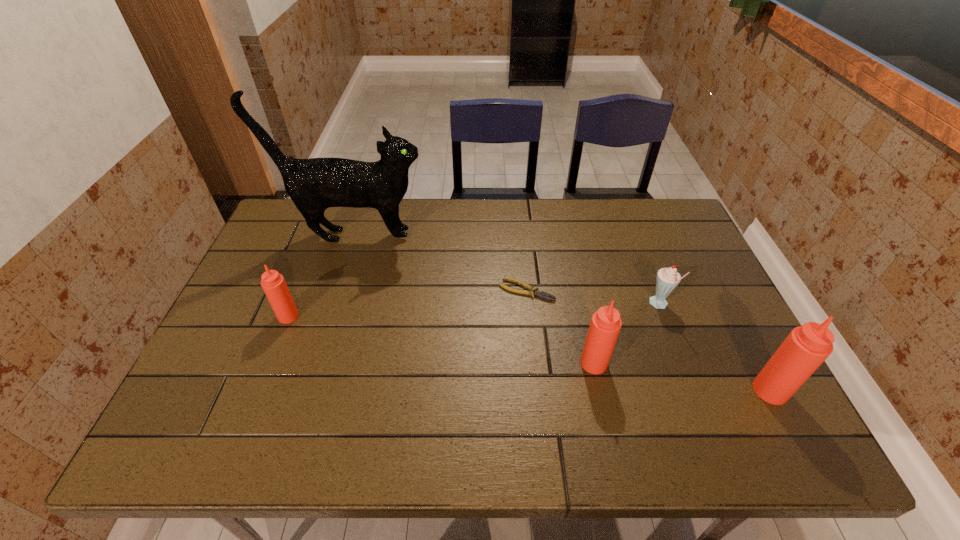
Find the location of `cat`. cat is located at coordinates (315, 184).

Where is `the farthest object`? Image resolution: width=960 pixels, height=540 pixels. the farthest object is located at coordinates (315, 184).

Find the location of a particular element. blank space located on the back of the farthest Tabasco sauce is located at coordinates (303, 280).

Find the location of a particular element. The image size is (960, 540). free region located on the back of the second nearest object is located at coordinates pyautogui.click(x=572, y=264).

The height and width of the screenshot is (540, 960). Identify the location of free location located on the left of the rightmost Tabasco sauce. (684, 390).

At what (x,y) coordinates should I click in order to perform the action: click on vacant space located on the straw side of the second object from right to left. Please return your answer as a coordinate pair (x, y). Looking at the image, I should click on (575, 305).

This screenshot has height=540, width=960. Find the location of `vacant space located 0.090m on the straw side of the second object from right to left`. vacant space located 0.090m on the straw side of the second object from right to left is located at coordinates (615, 305).

Locate an element on the screen. Image resolution: width=960 pixels, height=540 pixels. free point located 0.100m on the straw side of the second object from right to left is located at coordinates (612, 305).

Locate an element on the screen. The height and width of the screenshot is (540, 960). free spot located on the right of the pliers is located at coordinates (689, 291).

Where is `free spot located on the face of the farthest object`? The image size is (960, 540). free spot located on the face of the farthest object is located at coordinates (495, 236).